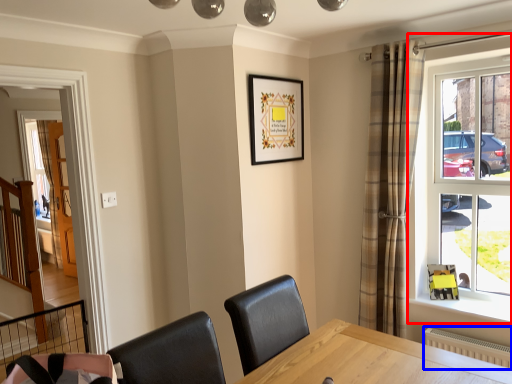
Question: Which point is closer to the camera, window (highlighted by a red box) or radiator (highlighted by a blue box)?

Choices:
 (A) window
 (B) radiator

Answer: (B)